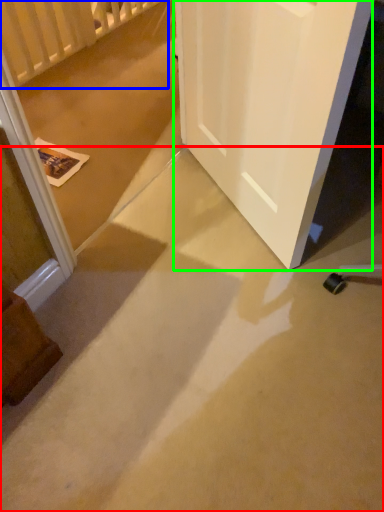
Question: Based on their relative distances, which object is farther from concrete (highlighted by a red box)? Choose from balustrade (highlighted by a blue box) and door (highlighted by a green box).

Choices:
 (A) balustrade
 (B) door

Answer: (A)